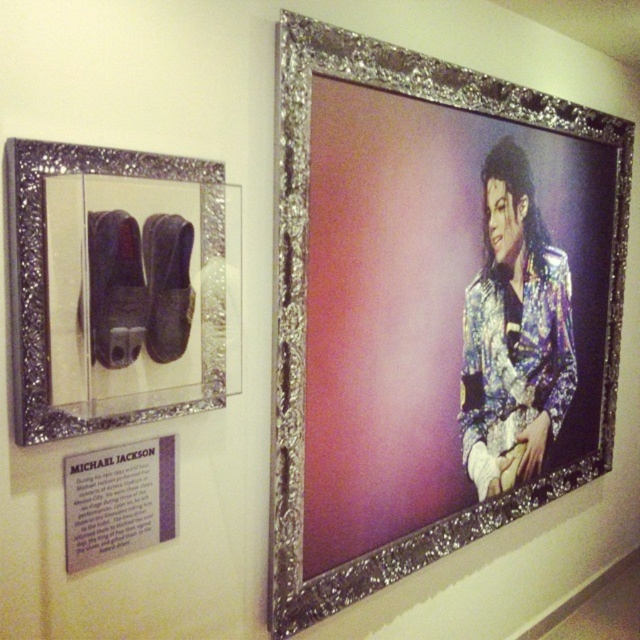
You are standing in front of the Michael Jackson exhibit and want to touch both points labeled as point (545,241) and point (20,352). Which point should you reach for first without moving your feet?

You should reach for point (545,241) first because it is closer to you than point (20,352), which is further away.